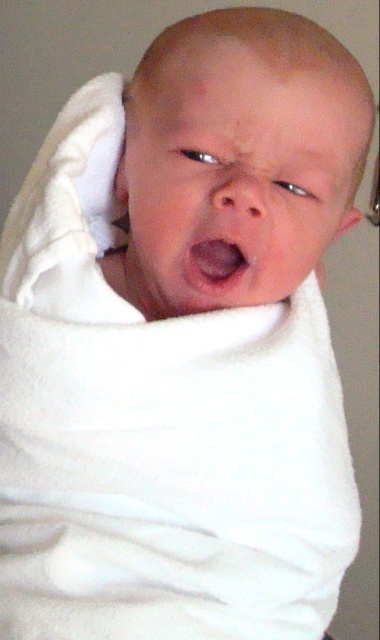
In the scene shown: Is white soft ear at upper left to the left of pink soft ear at upper right from the viewer's perspective?

Yes, white soft ear at upper left is to the left of pink soft ear at upper right.

Does white soft ear at upper left appear on the right side of pink soft ear at upper right?

Incorrect, white soft ear at upper left is not on the right side of pink soft ear at upper right.

The height and width of the screenshot is (640, 380). What are the coordinates of `white soft ear at upper left` in the screenshot? It's located at click(x=120, y=177).

Where is `white soft ear at upper left`? white soft ear at upper left is located at coordinates (120, 177).

Looking at this image, is pink smooth flesh at center to the left of white soft ear at upper left from the viewer's perspective?

No, pink smooth flesh at center is not to the left of white soft ear at upper left.

Is pink smooth flesh at center closer to camera compared to white soft ear at upper left?

That is True.

You are a GUI agent. You are given a task and a screenshot of the screen. Output one action in this format:
    pyautogui.click(x=<x>, y=<y>)
    Task: Click on the pink smooth flesh at center
    The image size is (380, 640).
    Given the screenshot: What is the action you would take?
    pyautogui.click(x=213, y=266)

The height and width of the screenshot is (640, 380). What are the coordinates of `pink smooth flesh at center` in the screenshot? It's located at (213, 266).

Is pink smooth flesh at center closer to camera compared to pink soft ear at upper right?

That is True.

Does pink smooth flesh at center have a larger size compared to pink soft ear at upper right?

Incorrect, pink smooth flesh at center is not larger than pink soft ear at upper right.

This screenshot has height=640, width=380. I want to click on pink smooth flesh at center, so click(x=213, y=266).

What are the coordinates of `pink smooth flesh at center` in the screenshot? It's located at (213, 266).